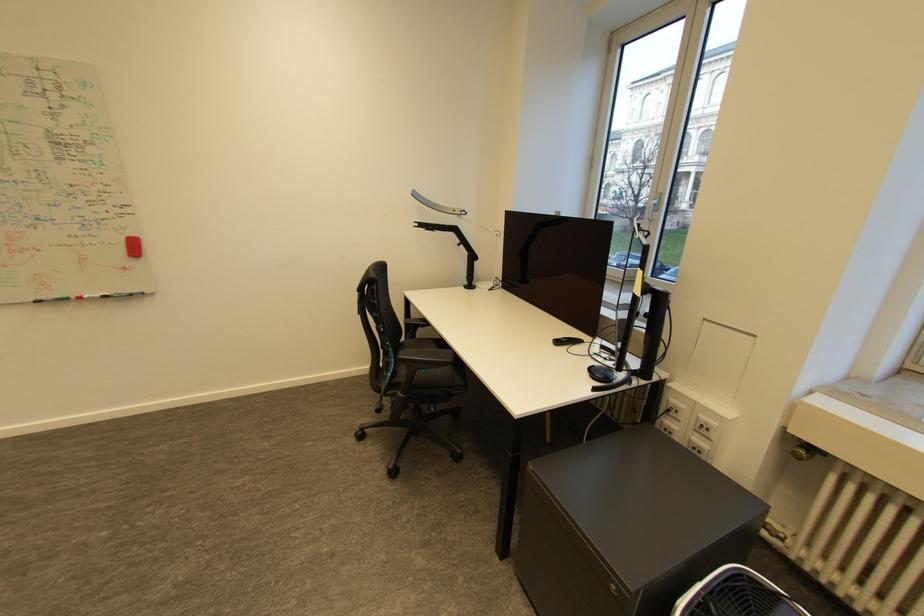
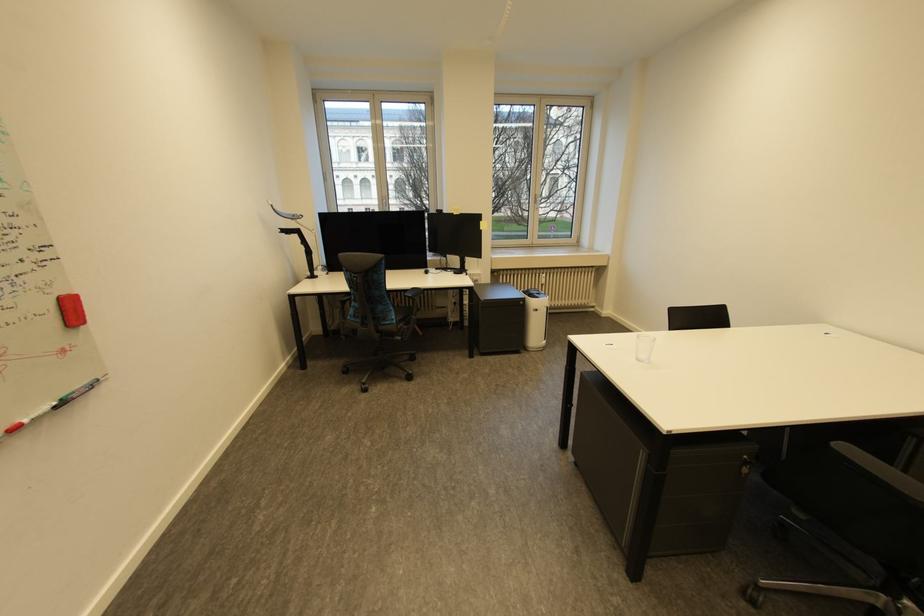
Locate, in the second image, the point that corresponds to pixel 79 298 in the first image.

(6, 436)